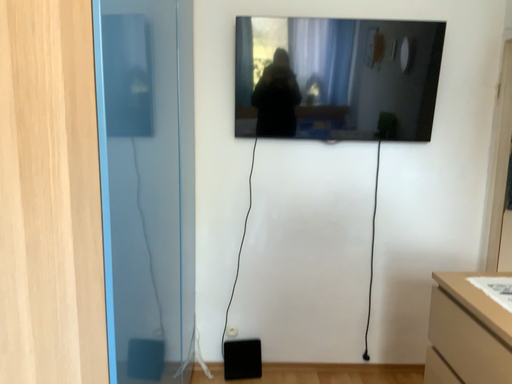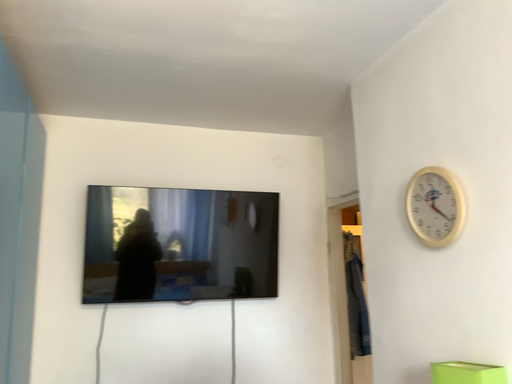
Question: Which way did the camera rotate in the video?

Choices:
 (A) rotated right
 (B) rotated left

Answer: (A)